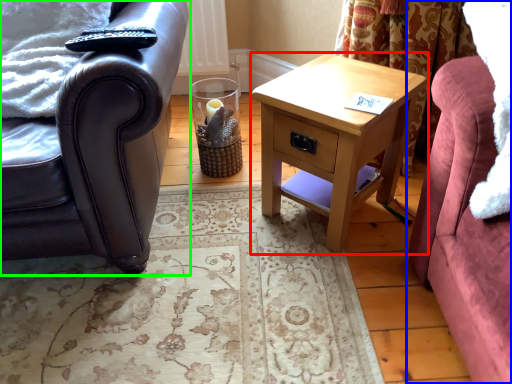
Question: Which object is positioned closest to nightstand (highlighted by a red box)? Select from studio couch (highlighted by a blue box) and chair (highlighted by a green box).

Choices:
 (A) studio couch
 (B) chair

Answer: (A)